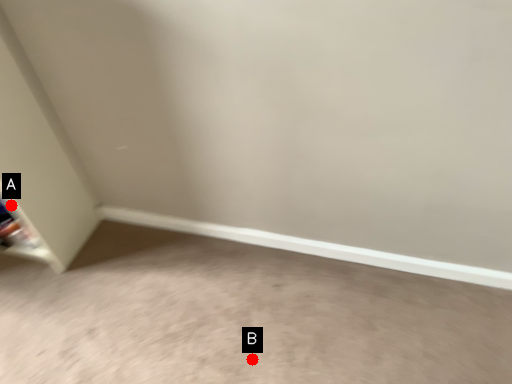
Question: Two points are circled on the image, labeled by A and B beside each circle. Which point is closer to the camera?

Choices:
 (A) A is closer
 (B) B is closer

Answer: (B)